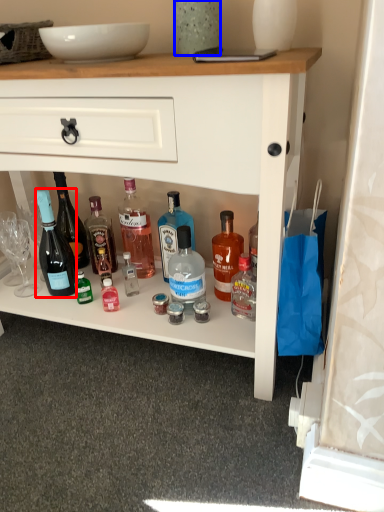
Question: Which point is closer to the camera, bottle (highlighted by a red box) or glass vase (highlighted by a blue box)?

Choices:
 (A) bottle
 (B) glass vase

Answer: (B)